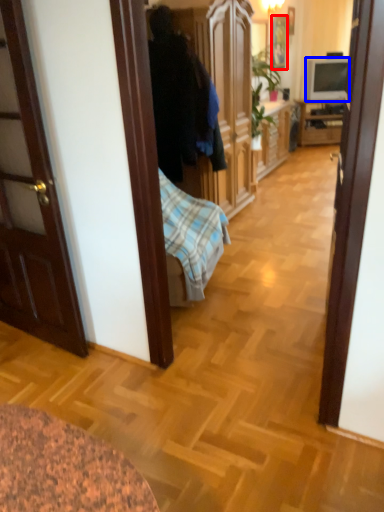
Question: Among these objects, which one is farthest to the camera, picture frame (highlighted by a red box) or television (highlighted by a blue box)?

Choices:
 (A) picture frame
 (B) television

Answer: (B)